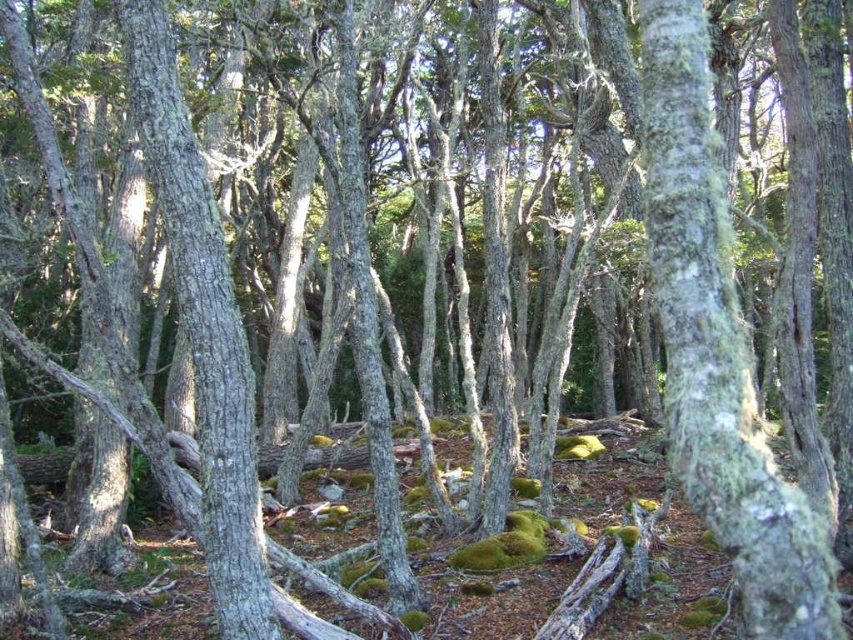
You are a hiker who needs to place a 3 meter long rope between the green mossy bark tree trunk at center and the smooth gray bark at center. Will the rope reach both ends?

The distance between the green mossy bark tree trunk at center and the smooth gray bark at center is 2.67 meters, so the 3 meter long rope will be long enough to reach both ends with some extra length remaining.

You are a hiker in the forest and want to place a small marker between the green mossy bark tree trunk at center and the smooth gray bark at center. Can you do this without placing it on top of either tree trunk?

The green mossy bark tree trunk at center is positioned over smooth gray bark at center, so there is no space between them to place the marker without it being on top of one of them.